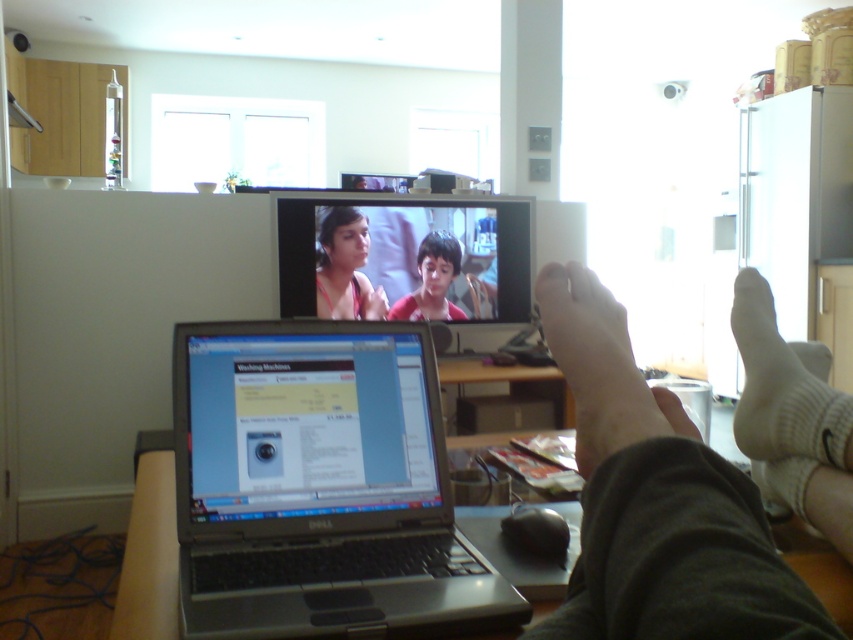
You are a person who wants to see the matte red shirt at center clearly. Since the matte pink fabric at upper center is blocking your view, where should you move to get a better look?

The matte pink fabric at upper center is located above the matte red shirt at center, so moving to the side or lower position would allow you to see the matte red shirt at center without obstruction.

Consider the image. You are a delivery person who needs to deliver a package to the room shown. The package is 10 inches wide. There is a white soft foot at lower right and a matte red shirt at center in the room. Which object can the package fit under if placed horizontally?

The package can fit under the white soft foot at lower right because it is smaller than the matte red shirt at center, allowing enough space for the 10 inch wide package.

Based on the photo, you are a delivery person who needs to place a package on the nearest surface to the silver metallic laptop at center. The package is 1 foot in length. The available surfaces are the matte pink fabric at upper center and the wooden countertop on the left. Which surface can the package fit on?

The package can fit on both surfaces. The distance between the silver metallic laptop at center and the matte pink fabric at upper center is 6.54 feet, so the package can be placed there. The wooden countertop on the left is also an available surface, but its distance isn not specified. However, since the package is only 1 foot long, both surfaces are large enough to accommodate it.